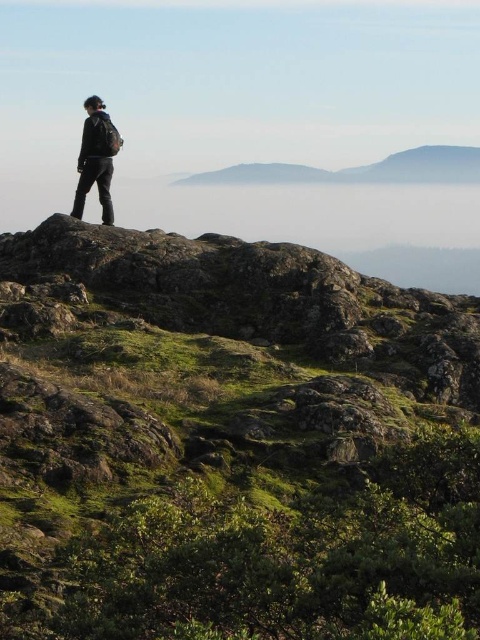
Question: Which point is farther to the camera?

Choices:
 (A) matte black jacket at center
 (B) green mossy rock at upper left

Answer: (A)

Question: Can you confirm if green mossy rock at upper left is positioned below smooth gray mountain at center?

Choices:
 (A) no
 (B) yes

Answer: (B)

Question: Can you confirm if smooth gray mountain at center is positioned below matte black jacket at center?

Choices:
 (A) yes
 (B) no

Answer: (B)

Question: Which object appears closest to the camera in this image?

Choices:
 (A) green mossy rock at upper left
 (B) matte black jacket at center
 (C) smooth gray mountain at center

Answer: (A)

Question: Does green mossy rock at upper left have a larger size compared to smooth gray mountain at center?

Choices:
 (A) yes
 (B) no

Answer: (B)

Question: Which object appears closest to the camera in this image?

Choices:
 (A) smooth gray mountain at center
 (B) green mossy rock at upper left

Answer: (B)